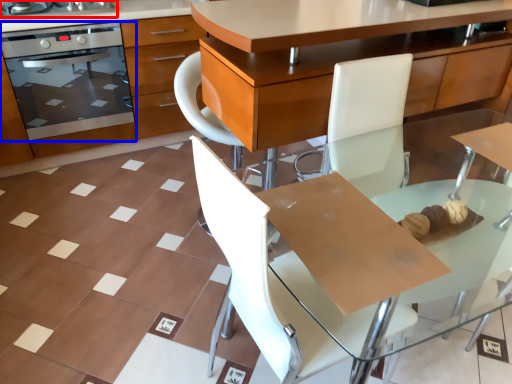
Question: Which point is further to the camera, home appliance (highlighted by a red box) or kitchen appliance (highlighted by a blue box)?

Choices:
 (A) home appliance
 (B) kitchen appliance

Answer: (B)